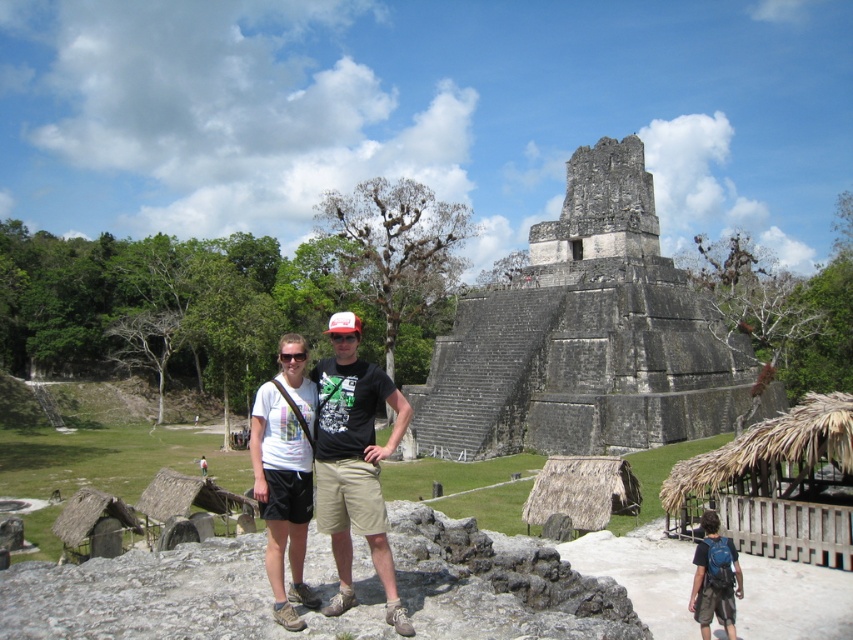
You are standing at the archaeological site and want to take a photo of the pyramid. You notice two points marked in the scene. The first point is at coordinate point(590, 346) and the second is at point(305, 428). Which point is closer to the pyramid?

Point(590, 346) is behind point(305, 428), so the point(590, 346) is closer to the pyramid.

You are a photographer trying to capture a photo of the gray stone ruins at center and the white cotton shirt at center. Which object should you focus on first if you want to ensure both are in sharp focus?

The gray stone ruins at center is much taller than the white cotton shirt at center, so you should focus on the gray stone ruins at center first to ensure depth of field covers both objects.

You are standing at the point marked as point (583, 337) in the image. What do you see around you?

You are standing at point (583, 337), which corresponds to the gray stone ruins at center. The ruins are part of an archaeological site, likely Tikal in Guatemala, with a large multi tiered pyramid in the background and two individuals posing on a rocky outcrop in the foreground.